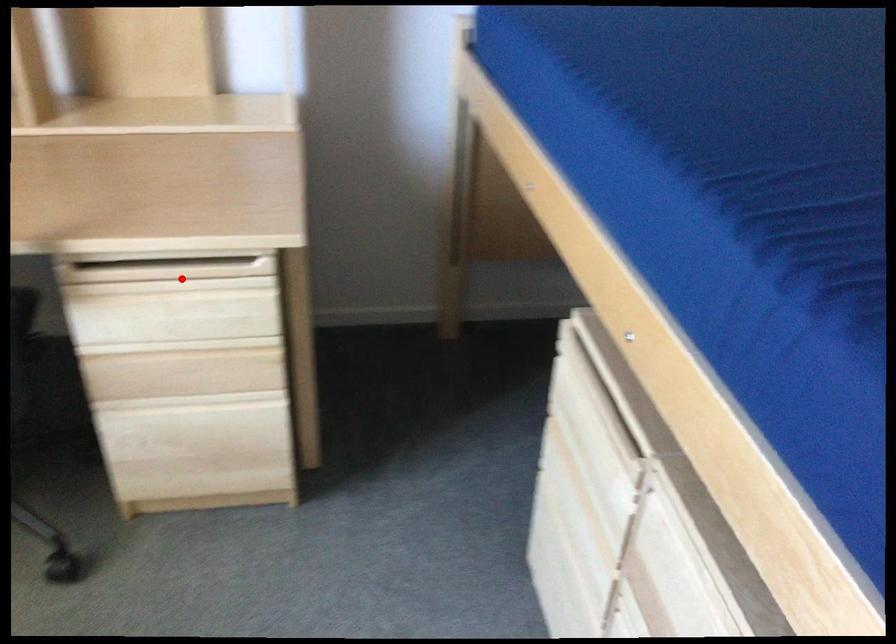
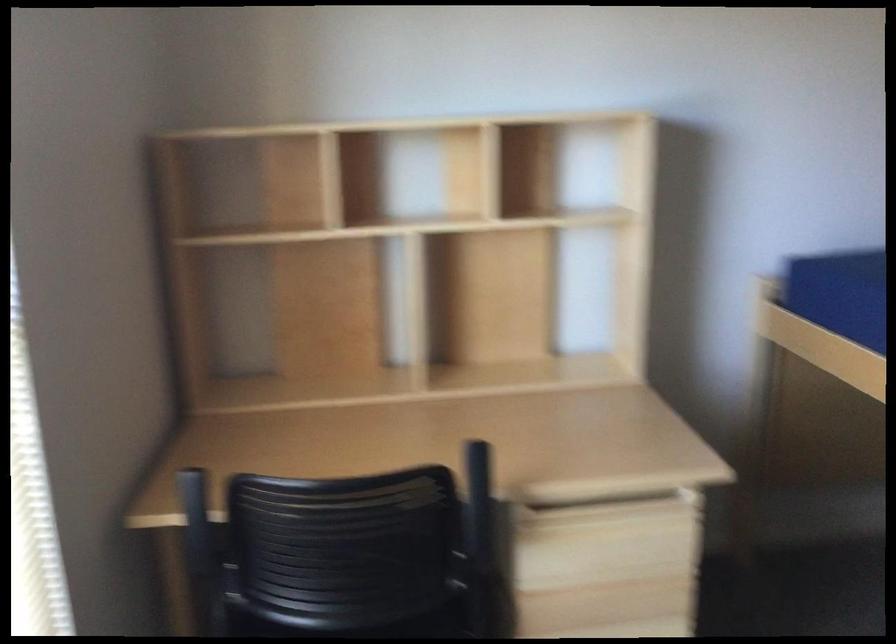
Find the pixel in the second image that matches the highlighted location in the first image.

(616, 520)